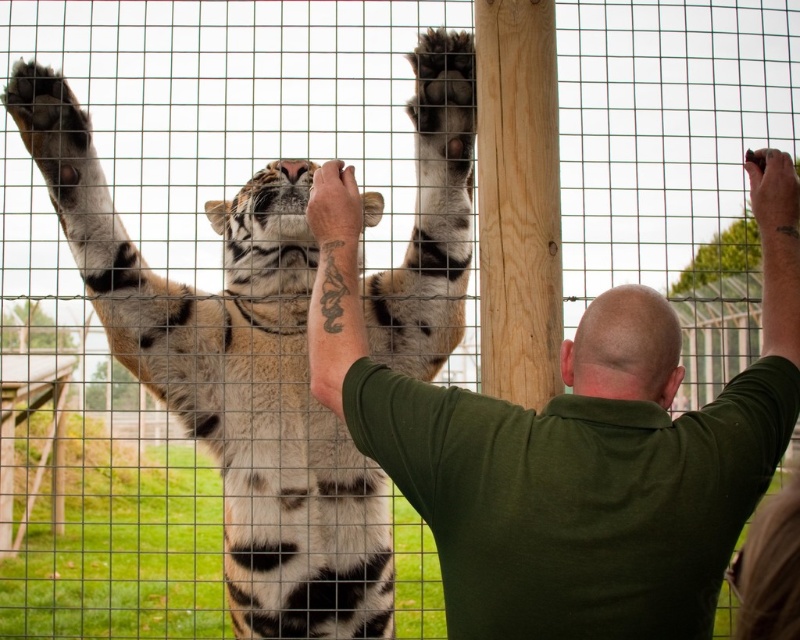
Question: Does green matte shirt at center appear on the left side of orange-brown fur tiger at center?

Choices:
 (A) no
 (B) yes

Answer: (A)

Question: Can you confirm if green matte shirt at center is positioned to the left of orange-brown fur tiger at center?

Choices:
 (A) yes
 (B) no

Answer: (B)

Question: Can you confirm if green matte shirt at center is positioned to the left of orange-brown fur tiger at center?

Choices:
 (A) yes
 (B) no

Answer: (B)

Question: Which point is farther to the camera?

Choices:
 (A) green matte shirt at center
 (B) orange-brown fur tiger at center

Answer: (B)